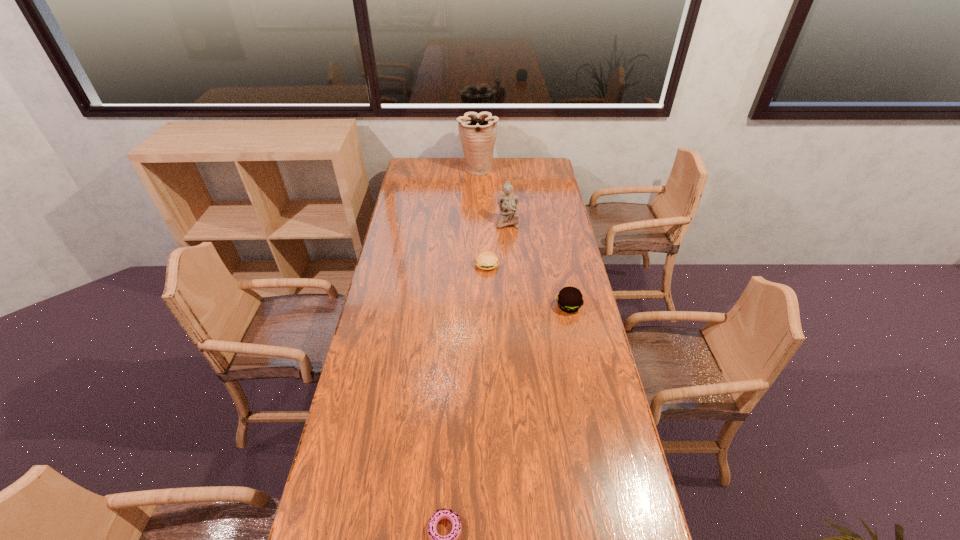
Image resolution: width=960 pixels, height=540 pixels. Identify the location of blank region between the fourth shortest object and the farthest object. (492, 196).

Identify the location of vacant area that lies between the farthest object and the figurine. (492, 196).

Where is `vacant area that lies between the farther patty and the fourth nearest object`? Image resolution: width=960 pixels, height=540 pixels. vacant area that lies between the farther patty and the fourth nearest object is located at coordinates (497, 244).

Point out which object is positioned as the third nearest to the fourth tallest object. Please provide its 2D coordinates. Your answer should be formatted as a tuple, i.e. [(x, y)], where the tuple contains the x and y coordinates of a point satisfying the conditions above.

[(478, 132)]

Select which object appears as the second closest to the left patty. Please provide its 2D coordinates. Your answer should be formatted as a tuple, i.e. [(x, y)], where the tuple contains the x and y coordinates of a point satisfying the conditions above.

[(569, 299)]

Identify the location of free region that satisfies the following two spatial constraints: 1. on the front side of the nearer patty; 2. on the left side of the farther patty. (488, 307).

Locate an element on the screen. This screenshot has width=960, height=540. free point that satisfies the following two spatial constraints: 1. on the front-facing side of the third tallest object; 2. on the right side of the fourth shortest object is located at coordinates (x=514, y=307).

Locate an element on the screen. The image size is (960, 540). free space that satisfies the following two spatial constraints: 1. on the front-facing side of the taller patty; 2. on the right side of the figurine is located at coordinates (514, 307).